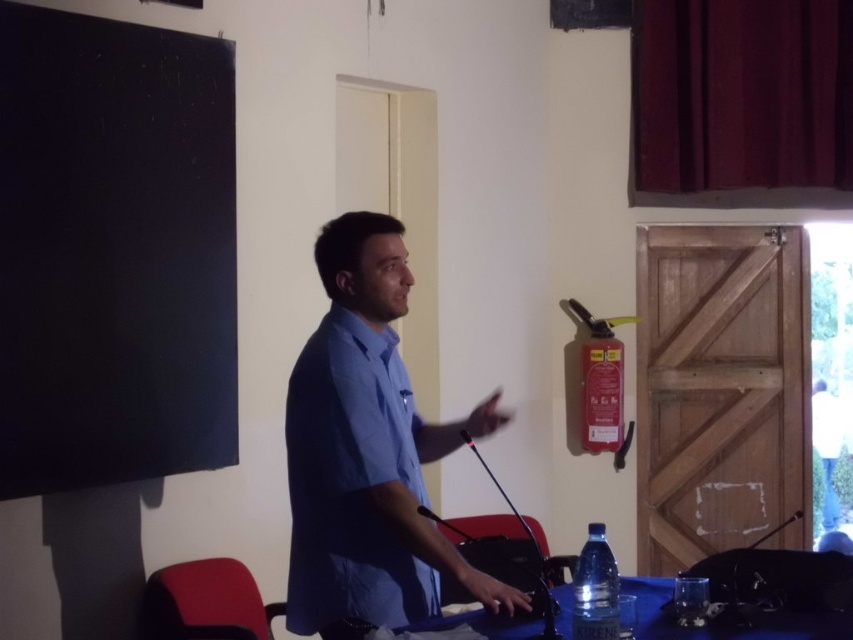
Question: Which point appears farthest from the camera in this image?

Choices:
 (A) (489, 477)
 (B) (647, 618)

Answer: (A)

Question: Which of these objects is positioned closest to the black metallic microphone at center?

Choices:
 (A) black plastic microphone at lower right
 (B) clear plastic bottle at lower center
 (C) blue cotton shirt at center
 (D) blue fabric table at lower center

Answer: (B)

Question: Among these points, which one is farthest from the camera?

Choices:
 (A) (728, 630)
 (B) (305, 481)
 (C) (556, 609)

Answer: (C)

Question: Is the position of clear plastic bottle at lower center more distant than that of black metallic microphone at center?

Choices:
 (A) no
 (B) yes

Answer: (B)

Question: Does blue fabric table at lower center appear on the left side of clear plastic bottle at lower center?

Choices:
 (A) yes
 (B) no

Answer: (B)

Question: Does blue cotton shirt at center appear on the left side of blue fabric table at lower center?

Choices:
 (A) yes
 (B) no

Answer: (A)